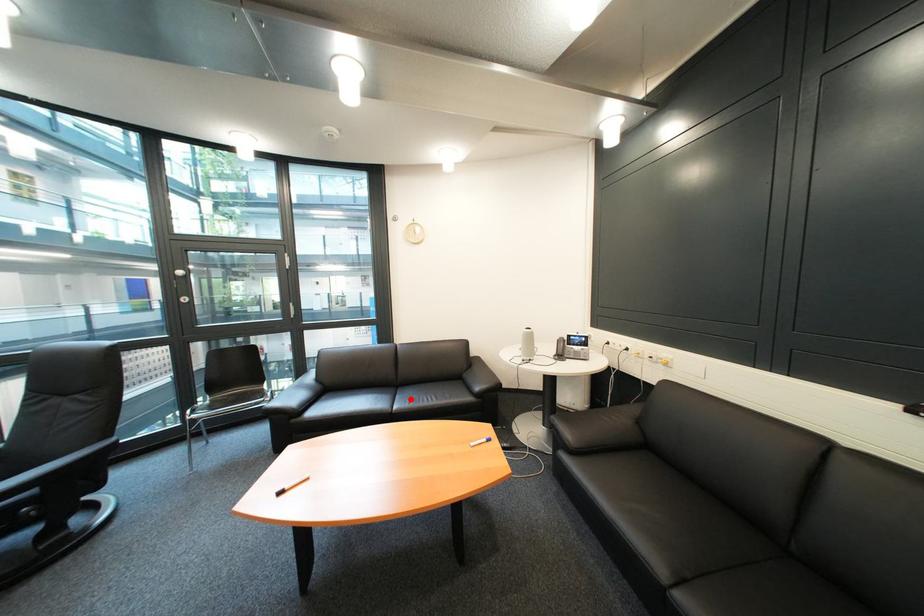
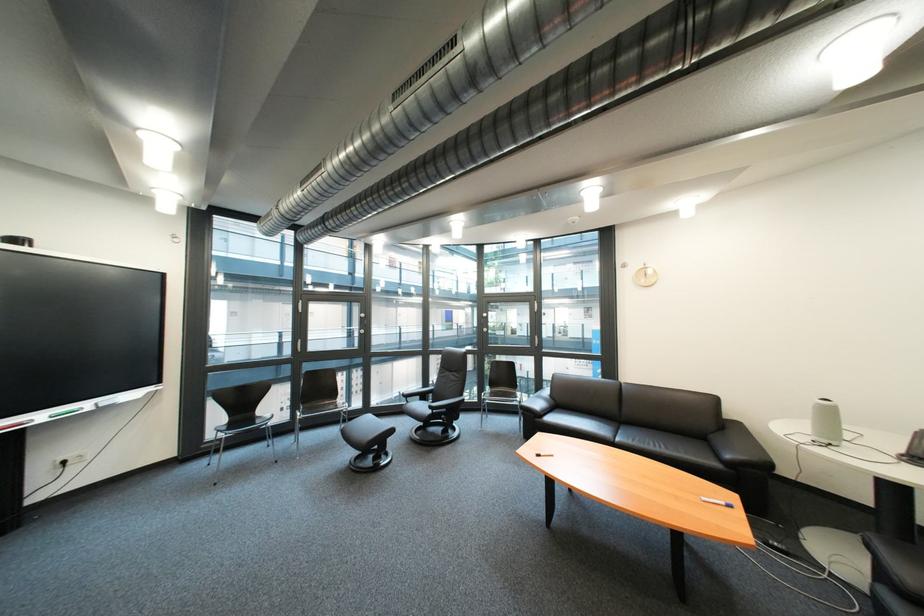
Locate, in the second image, the point that corresponds to the highlighted location in the first image.

(634, 434)